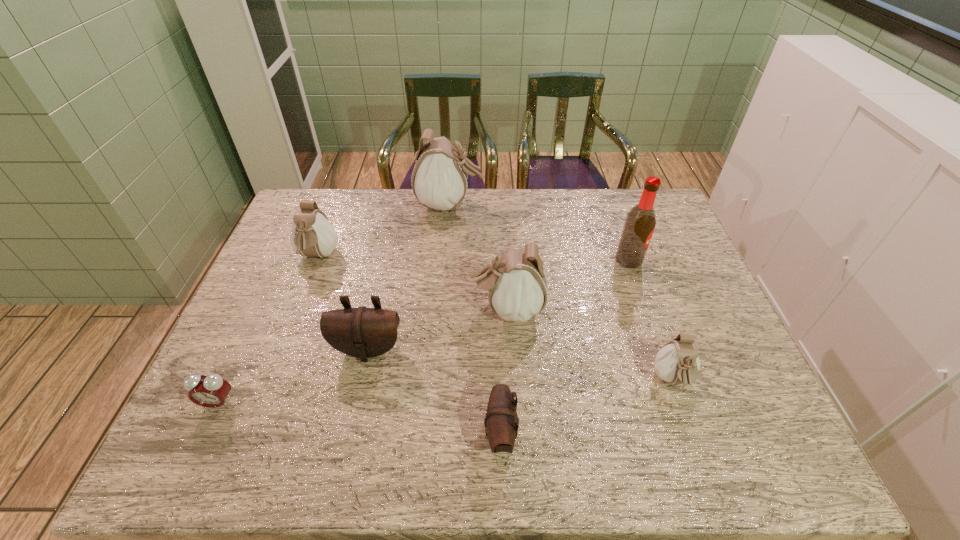
The image size is (960, 540). In order to click on the rightmost pouch in this screenshot , I will do `click(677, 362)`.

Locate an element on the screen. The height and width of the screenshot is (540, 960). the right brown pouch is located at coordinates (501, 418).

Where is `the nearest pouch`? The image size is (960, 540). the nearest pouch is located at coordinates (501, 418).

The width and height of the screenshot is (960, 540). Identify the location of alarm clock. (211, 391).

Where is `blank space located 0.290m on the front of the beer bottle`? The width and height of the screenshot is (960, 540). blank space located 0.290m on the front of the beer bottle is located at coordinates (660, 348).

Image resolution: width=960 pixels, height=540 pixels. I want to click on free space located on the front-facing side of the tallest pouch, so click(x=554, y=205).

Find the location of a particular element. This screenshot has height=540, width=960. vacant point located on the front-facing side of the third tallest object is located at coordinates (391, 309).

This screenshot has height=540, width=960. Identify the location of free space located on the front-facing side of the third tallest object. (442, 309).

Image resolution: width=960 pixels, height=540 pixels. Find the location of `vacant area situated 0.050m on the front-facing side of the third tallest object`. vacant area situated 0.050m on the front-facing side of the third tallest object is located at coordinates (452, 309).

The height and width of the screenshot is (540, 960). Identify the location of vacant position located 0.080m on the front-facing side of the leftmost pouch. (303, 295).